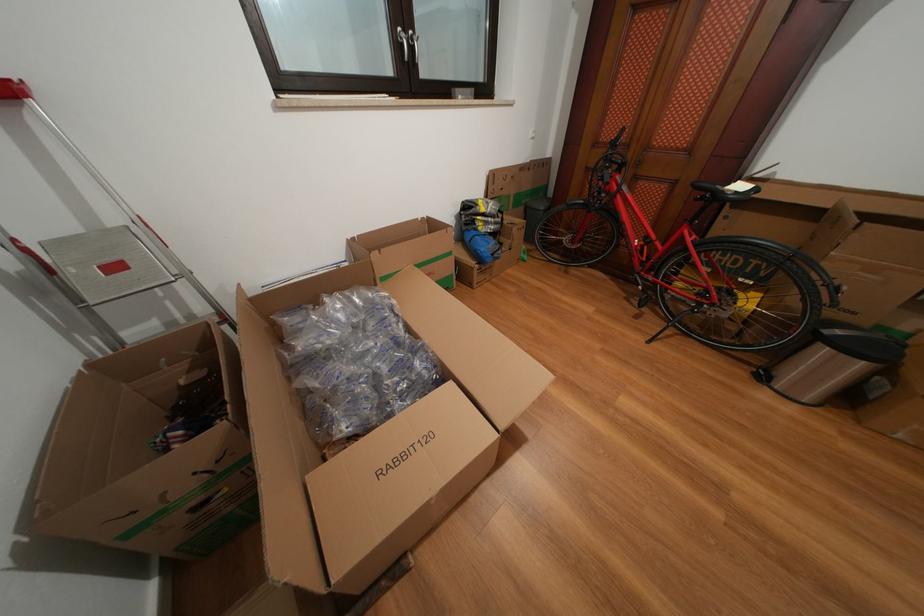
Where would you press the trash can pedal? Please return your answer as a coordinate pair (x, y).

(761, 374)